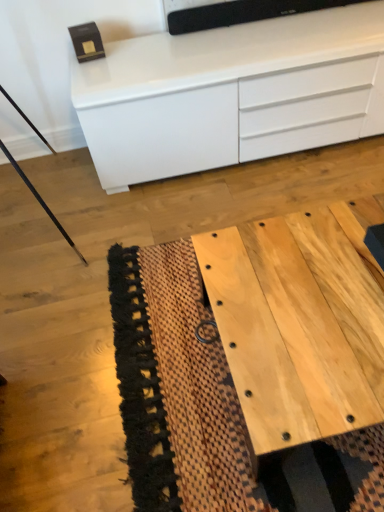
What do you see at coordinates (298, 324) in the screenshot? I see `natural wood table at lower right` at bounding box center [298, 324].

At what (x,y) coordinates should I click in order to perform the action: click on natural wood table at lower right. Please return your answer as a coordinate pair (x, y). Looking at the image, I should click on (298, 324).

Find the location of a particular element. The image size is (384, 512). white glossy chest of drawers at upper center is located at coordinates (231, 94).

The image size is (384, 512). What do you see at coordinates (231, 94) in the screenshot?
I see `white glossy chest of drawers at upper center` at bounding box center [231, 94].

Where is `natural wood table at lower right`? natural wood table at lower right is located at coordinates (298, 324).

Considering the relative positions of natural wood table at lower right and white glossy chest of drawers at upper center in the image provided, is natural wood table at lower right to the left or to the right of white glossy chest of drawers at upper center?

natural wood table at lower right is positioned on white glossy chest of drawers at upper center's right side.

Between natural wood table at lower right and white glossy chest of drawers at upper center, which one is positioned behind?

white glossy chest of drawers at upper center is behind.

Between point (336, 218) and point (124, 146), which one is positioned behind?

The point (124, 146) is farther from the camera.

From the image's perspective, who appears lower, natural wood table at lower right or white glossy chest of drawers at upper center?

natural wood table at lower right.

From a real-world perspective, between natural wood table at lower right and white glossy chest of drawers at upper center, who is vertically lower?

natural wood table at lower right is physically lower.

Does natural wood table at lower right have a lesser width compared to white glossy chest of drawers at upper center?

In fact, natural wood table at lower right might be wider than white glossy chest of drawers at upper center.

Which of these two, natural wood table at lower right or white glossy chest of drawers at upper center, stands taller?

With more height is white glossy chest of drawers at upper center.

Considering the relative sizes of natural wood table at lower right and white glossy chest of drawers at upper center in the image provided, is natural wood table at lower right smaller than white glossy chest of drawers at upper center?

Indeed, natural wood table at lower right has a smaller size compared to white glossy chest of drawers at upper center.

Is natural wood table at lower right inside or outside of white glossy chest of drawers at upper center?

natural wood table at lower right exists outside the volume of white glossy chest of drawers at upper center.

In the scene shown: Are natural wood table at lower right and white glossy chest of drawers at upper center located far from each other?

natural wood table at lower right is actually quite close to white glossy chest of drawers at upper center.

Is natural wood table at lower right looking in the opposite direction of white glossy chest of drawers at upper center?

Yes, natural wood table at lower right is facing away from white glossy chest of drawers at upper center.

Can you tell me how much natural wood table at lower right and white glossy chest of drawers at upper center differ in facing direction?

0.537 degrees separate the facing orientations of natural wood table at lower right and white glossy chest of drawers at upper center.

How distant is natural wood table at lower right from white glossy chest of drawers at upper center?

83.37 centimeters.

This screenshot has width=384, height=512. Find the location of `chest of drawers above the natural wood table at lower right (from a real-world perspective)`. chest of drawers above the natural wood table at lower right (from a real-world perspective) is located at coordinates (231, 94).

Considering the positions of objects white glossy chest of drawers at upper center and natural wood table at lower right in the image provided, who is more to the right, white glossy chest of drawers at upper center or natural wood table at lower right?

Positioned to the right is natural wood table at lower right.

Is white glossy chest of drawers at upper center further to camera compared to natural wood table at lower right?

Yes, it is.

Considering the points (360, 46) and (359, 238), which point is in front, point (360, 46) or point (359, 238)?

The point (359, 238) is closer.

From the picture: From the image's perspective, relative to natural wood table at lower right, is white glossy chest of drawers at upper center above or below?

Based on their image positions, white glossy chest of drawers at upper center is located above natural wood table at lower right.

From a real-world perspective, which is physically below, white glossy chest of drawers at upper center or natural wood table at lower right?

natural wood table at lower right is physically lower.

Does white glossy chest of drawers at upper center have a greater width compared to natural wood table at lower right?

In fact, white glossy chest of drawers at upper center might be narrower than natural wood table at lower right.

Between white glossy chest of drawers at upper center and natural wood table at lower right, which one has more height?

With more height is white glossy chest of drawers at upper center.

Does white glossy chest of drawers at upper center have a larger size compared to natural wood table at lower right?

Yes.

Do you think white glossy chest of drawers at upper center is within natural wood table at lower right, or outside of it?

white glossy chest of drawers at upper center cannot be found inside natural wood table at lower right.

Are white glossy chest of drawers at upper center and natural wood table at lower right located far from each other?

They are positioned close to each other.

Could you tell me if white glossy chest of drawers at upper center is turned towards natural wood table at lower right?

Yes, white glossy chest of drawers at upper center is turned towards natural wood table at lower right.

How far apart are white glossy chest of drawers at upper center and natural wood table at lower right?

32.82 inches.

The width and height of the screenshot is (384, 512). Find the location of `chest of drawers above the natural wood table at lower right (from a real-world perspective)`. chest of drawers above the natural wood table at lower right (from a real-world perspective) is located at coordinates (231, 94).

The image size is (384, 512). What are the coordinates of `table in front of the white glossy chest of drawers at upper center` in the screenshot? It's located at (298, 324).

The width and height of the screenshot is (384, 512). In order to click on table below the white glossy chest of drawers at upper center (from a real-world perspective) in this screenshot , I will do `click(298, 324)`.